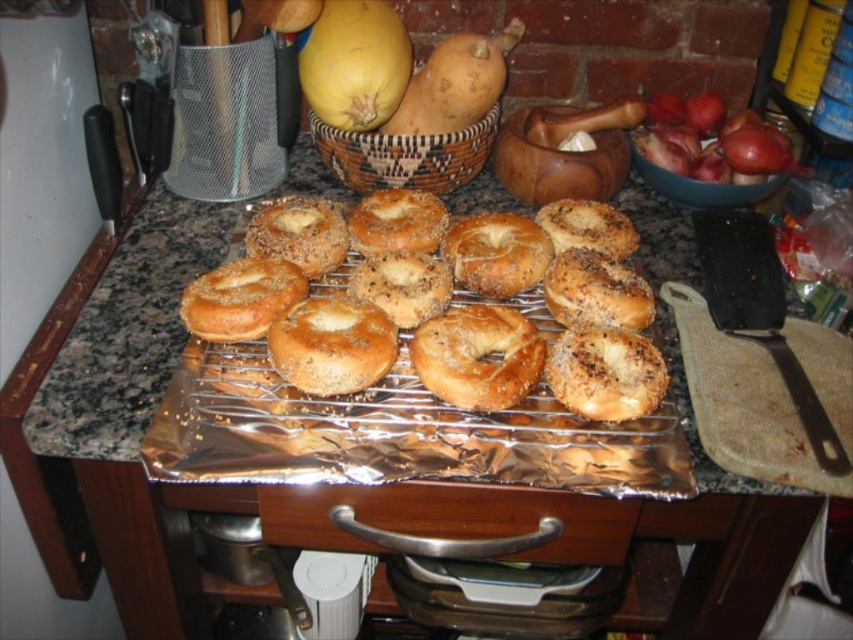
You are a chef organizing ingredients on the kitchen countertop. You need to place the yellow matte squash at upper center and the brown textured bagel at center into a basket. Which one should you place first to ensure proper stacking?

The yellow matte squash at upper center should be placed first because it is located above the brown textured bagel at center, indicating it should be at the bottom of the stack.

You are a chef who needs to stack the golden brown bagel at center and the woven brown basket at upper center onto a shelf. Which one should you place first to ensure stability?

The golden brown bagel at center is taller than the woven brown basket at upper center. To ensure stability, you should place the taller golden brown bagel at center first on the lower shelf and then the shorter woven brown basket at upper center on top of it.